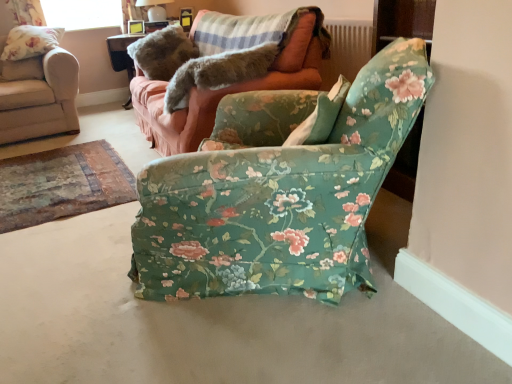
Question: Can you confirm if furry gray cat at upper center is smaller than matte wooden picture frame at upper center?

Choices:
 (A) yes
 (B) no

Answer: (B)

Question: Can you confirm if furry gray cat at upper center is wider than matte wooden picture frame at upper center?

Choices:
 (A) yes
 (B) no

Answer: (A)

Question: Can you confirm if furry gray cat at upper center is positioned to the left of matte wooden picture frame at upper center?

Choices:
 (A) yes
 (B) no

Answer: (B)

Question: Considering the relative positions of furry gray cat at upper center and matte wooden picture frame at upper center in the image provided, is furry gray cat at upper center in front of matte wooden picture frame at upper center?

Choices:
 (A) yes
 (B) no

Answer: (A)

Question: Is furry gray cat at upper center at the right side of matte wooden picture frame at upper center?

Choices:
 (A) yes
 (B) no

Answer: (A)

Question: Is furry gray cat at upper center bigger or smaller than floral fabric chair at center, the 2th chair when ordered from left to right?

Choices:
 (A) small
 (B) big

Answer: (A)

Question: Relative to floral fabric chair at center, acting as the first chair starting from the right, is furry gray cat at upper center in front or behind?

Choices:
 (A) behind
 (B) front

Answer: (A)

Question: From the image's perspective, is furry gray cat at upper center positioned above or below floral fabric chair at center, marked as the 2th chair in a back-to-front arrangement?

Choices:
 (A) below
 (B) above

Answer: (B)

Question: In the image, is furry gray cat at upper center on the left side or the right side of floral fabric chair at center, the 2th chair when ordered from left to right?

Choices:
 (A) right
 (B) left

Answer: (B)

Question: Is matte white lampshade at upper center situated inside matte wooden picture frame at upper center or outside?

Choices:
 (A) outside
 (B) inside

Answer: (A)

Question: From a real-world perspective, relative to matte wooden picture frame at upper center, is matte white lampshade at upper center vertically above or below?

Choices:
 (A) above
 (B) below

Answer: (A)

Question: Looking at the image, does matte white lampshade at upper center seem bigger or smaller compared to matte wooden picture frame at upper center?

Choices:
 (A) small
 (B) big

Answer: (B)

Question: From their relative heights in the image, would you say matte white lampshade at upper center is taller or shorter than matte wooden picture frame at upper center?

Choices:
 (A) tall
 (B) short

Answer: (A)

Question: Is point (216, 87) positioned closer to the camera than point (141, 33)?

Choices:
 (A) farther
 (B) closer

Answer: (B)

Question: Considering the positions of furry gray cat at upper center and matte wooden picture frame at upper center in the image, is furry gray cat at upper center taller or shorter than matte wooden picture frame at upper center?

Choices:
 (A) tall
 (B) short

Answer: (A)